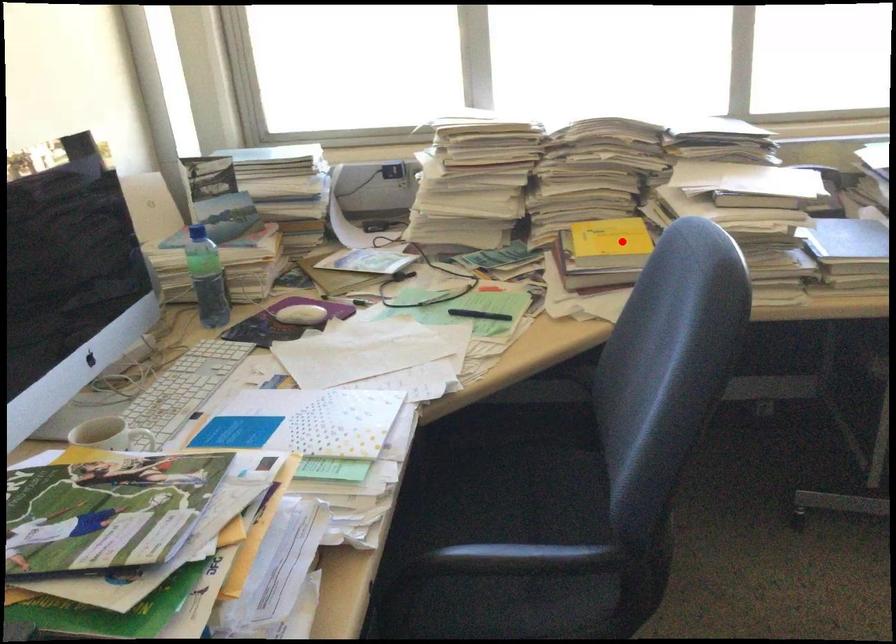
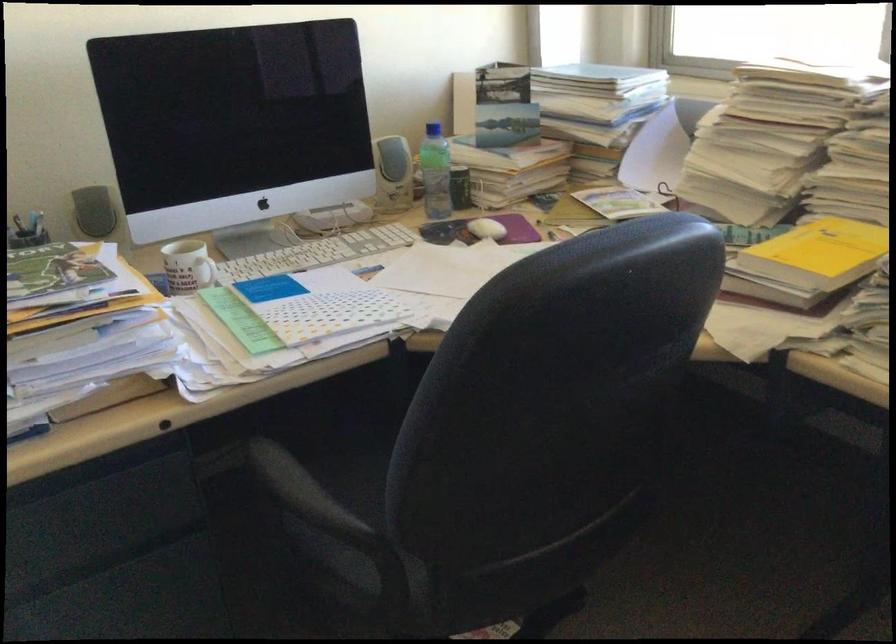
The point at the highlighted location is marked in the first image. Where is the corresponding point in the second image?

(819, 252)